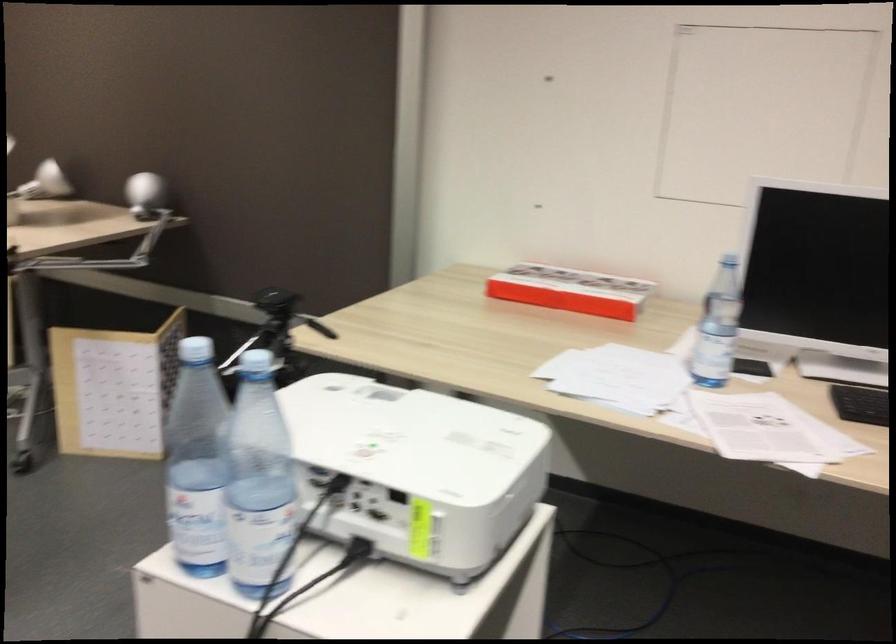
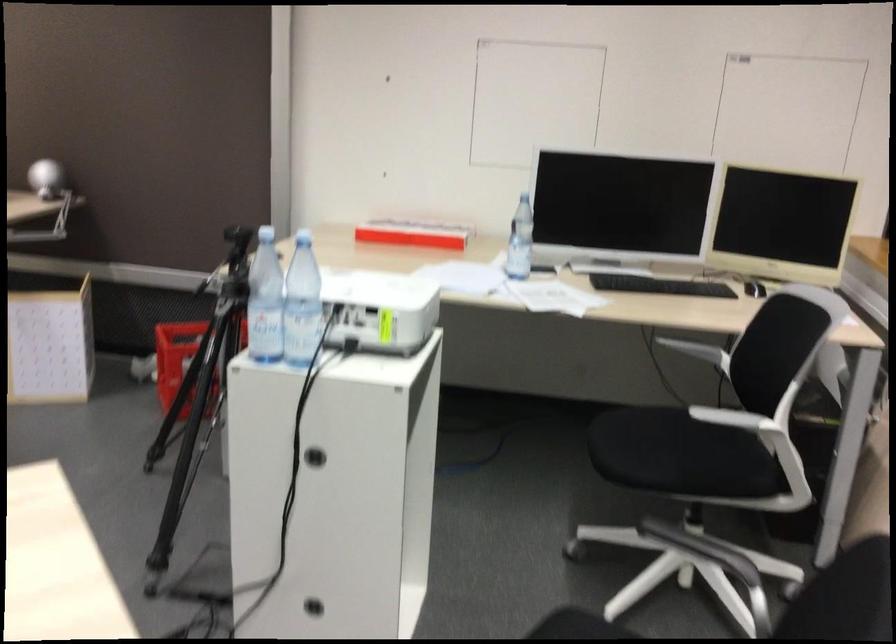
The point at (306, 464) is marked in the first image. Where is the corresponding point in the second image?

(302, 303)